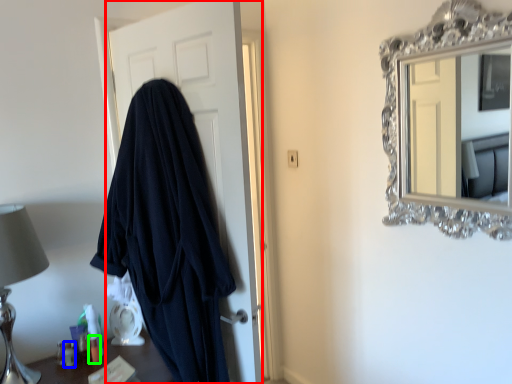
Question: Which object is the closest to the door (highlighted by a red box)? Choose among these: toiletry (highlighted by a blue box) or toiletry (highlighted by a green box).

Choices:
 (A) toiletry
 (B) toiletry

Answer: (B)